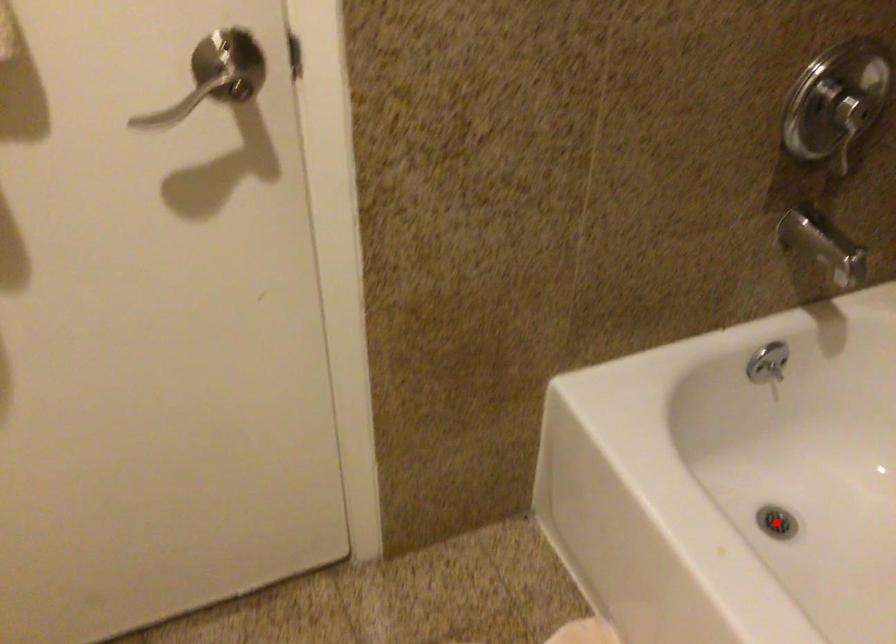
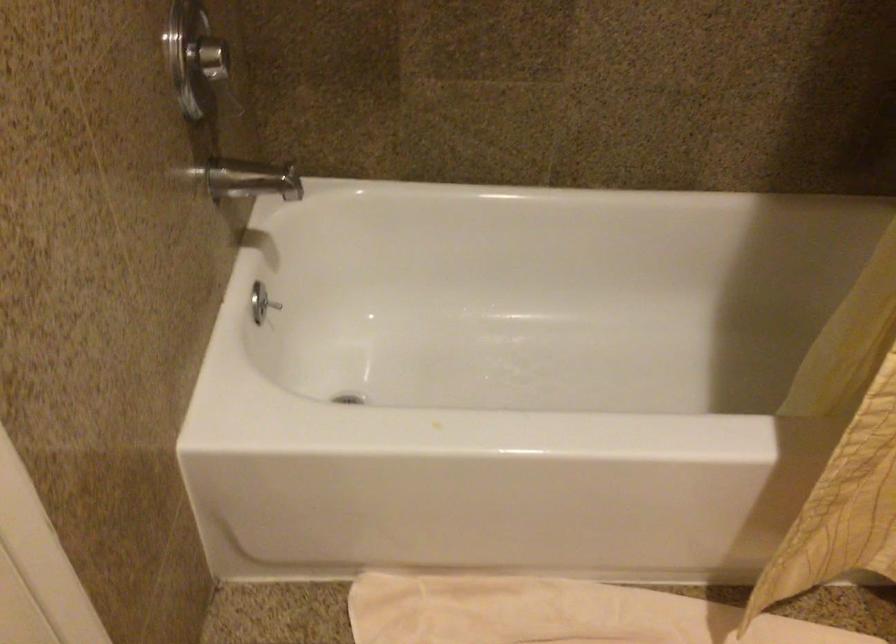
Question: I am providing you with two images of the same scene from different viewpoints. A red point is marked on the first image. Can you still see the location of the red point in image 2?

Choices:
 (A) Yes
 (B) No

Answer: (B)